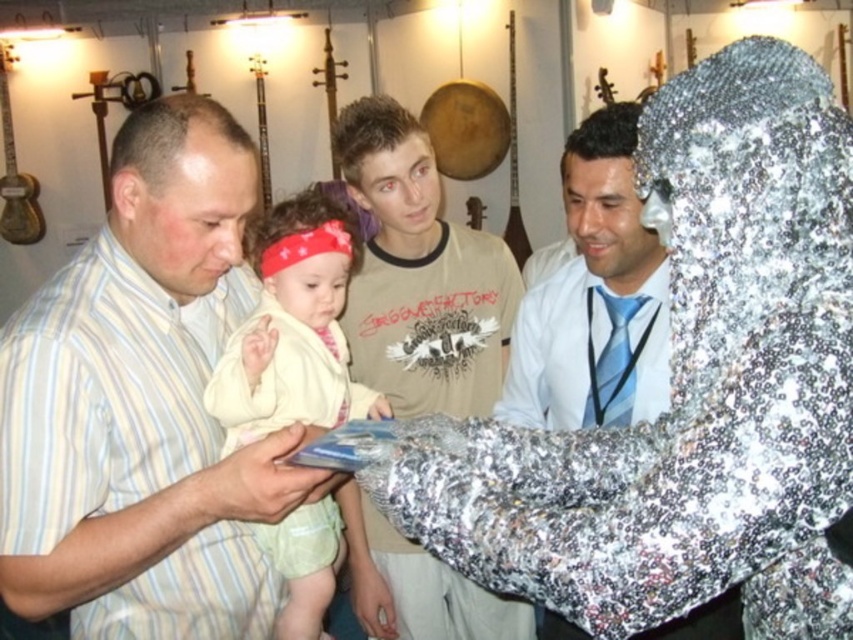
You are standing in the music exhibition and want to reach the point at coordinates (579, 243). If you take a step forward of 1.5 meters, will you reach that point?

The point at coordinates (579, 243) is 1.93 meters away from the viewer. Taking a step forward of 1.5 meters would bring you to 0.43 meters away from the point, so yes, you will reach it.

You are a photographer trying to capture a candid shot of the light yellow fabric baby at center and the blue silk tie at center. Which object should you focus on first if you want to include both in your frame without moving the camera? Please explain your reasoning based on their positions.

The light yellow fabric baby at center is positioned on the left side of the blue silk tie at center. Since the light yellow fabric baby at center is to the left, you should focus on it first to ensure both objects are within the frame without moving the camera.